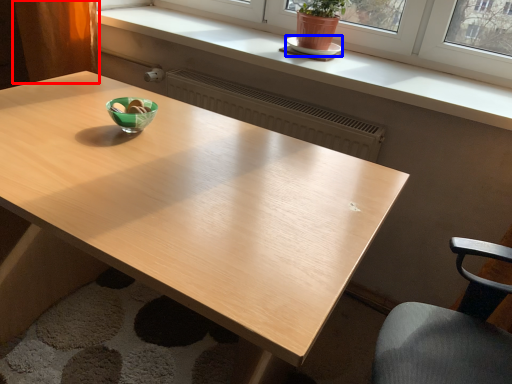
Question: Which point is closer to the camera, curtain (highlighted by a red box) or saucer (highlighted by a blue box)?

Choices:
 (A) curtain
 (B) saucer

Answer: (B)